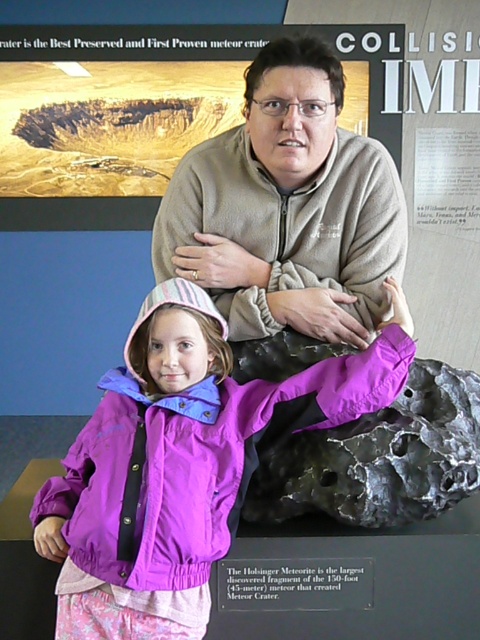
Is gray fleece sweater at center bigger than rough metallic rock at center?

Yes.

Who is more distant from viewer, (240, 195) or (299, 499)?

The point (240, 195) is behind.

Describe the element at coordinates (288, 208) in the screenshot. Image resolution: width=480 pixels, height=640 pixels. I see `gray fleece sweater at center` at that location.

Locate an element on the screen. gray fleece sweater at center is located at coordinates (288, 208).

From the picture: Does purple nylon jacket at center have a greater height compared to gray fleece sweater at center?

Correct, purple nylon jacket at center is much taller as gray fleece sweater at center.

Who is more distant from viewer, (103,472) or (299,180)?

Positioned behind is point (299,180).

Where is `purple nylon jacket at center`? This screenshot has height=640, width=480. purple nylon jacket at center is located at coordinates (182, 465).

Does purple nylon jacket at center have a greater width compared to rough metallic rock at center?

Indeed, purple nylon jacket at center has a greater width compared to rough metallic rock at center.

Who is higher up, purple nylon jacket at center or rough metallic rock at center?

Positioned higher is rough metallic rock at center.

Is point (80, 470) positioned behind point (411, 468)?

Yes, point (80, 470) is behind point (411, 468).

The image size is (480, 640). Find the location of `purple nylon jacket at center`. purple nylon jacket at center is located at coordinates (182, 465).